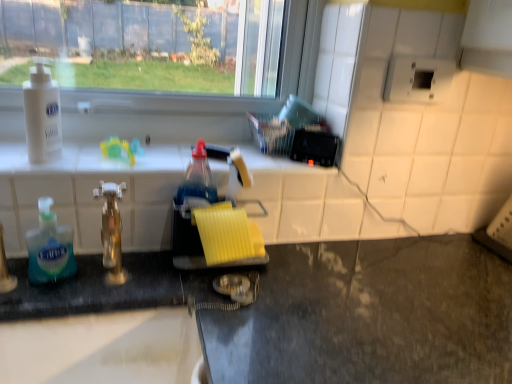
Find the location of `vacant area in front of yellow sponge at center`. vacant area in front of yellow sponge at center is located at coordinates (242, 327).